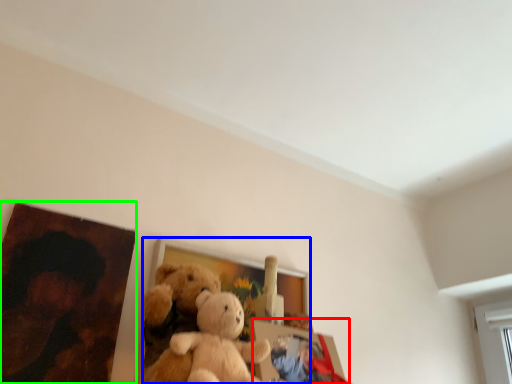
Question: Considering the real-world distances, which object is farthest from picture frame (highlighted by a red box)? picture frame (highlighted by a blue box) or picture frame (highlighted by a green box)?

Choices:
 (A) picture frame
 (B) picture frame

Answer: (B)